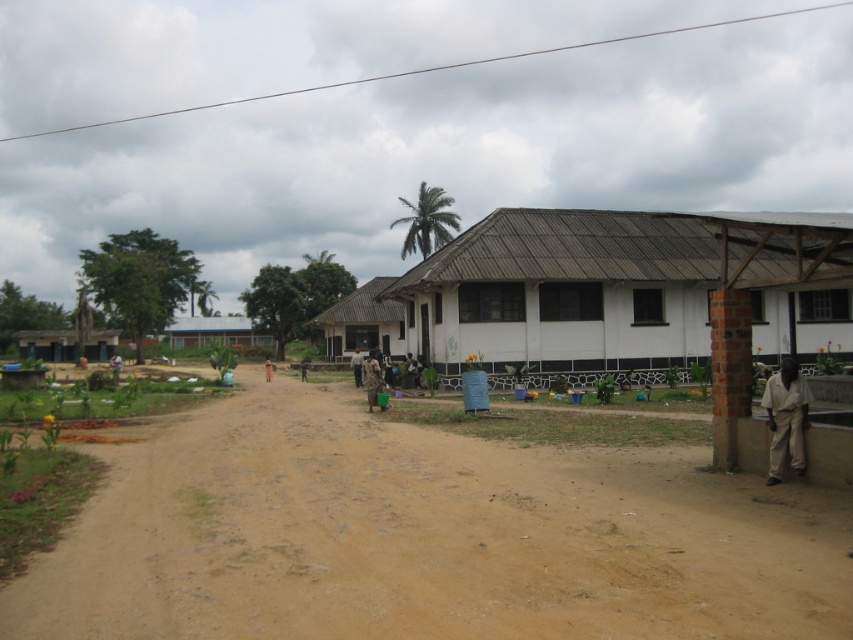
Does point (352, 394) lie in front of point (350, 362)?

That is True.

Where is `brown dirt field at center`? brown dirt field at center is located at coordinates (425, 538).

Which is in front, point (200, 346) or point (268, 372)?

Point (268, 372)

Who is shorter, blue corrugated metal hut at center or brown fabric bag at center?

brown fabric bag at center is shorter.

Between point (241, 324) and point (271, 378), which one is positioned in front?

Point (271, 378) is in front.

At what (x,y) coordinates should I click in order to perform the action: click on blue corrugated metal hut at center. Please return your answer as a coordinate pair (x, y). This screenshot has width=853, height=640. Looking at the image, I should click on coord(213,332).

Does light brown fabric pants at lower right have a lesser width compared to blue corrugated metal hut at center?

Yes, light brown fabric pants at lower right is thinner than blue corrugated metal hut at center.

Does light brown fabric pants at lower right appear under blue corrugated metal hut at center?

Indeed, light brown fabric pants at lower right is positioned under blue corrugated metal hut at center.

This screenshot has width=853, height=640. In order to click on light brown fabric pants at lower right in this screenshot , I will do [786, 419].